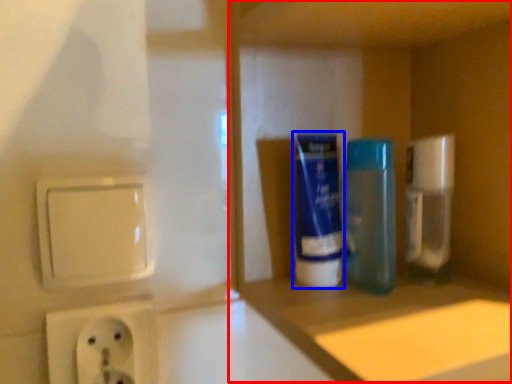
Question: Which of the following is the farthest to the observer, cabinet (highlighted by a red box) or mouthwash (highlighted by a blue box)?

Choices:
 (A) cabinet
 (B) mouthwash

Answer: (B)